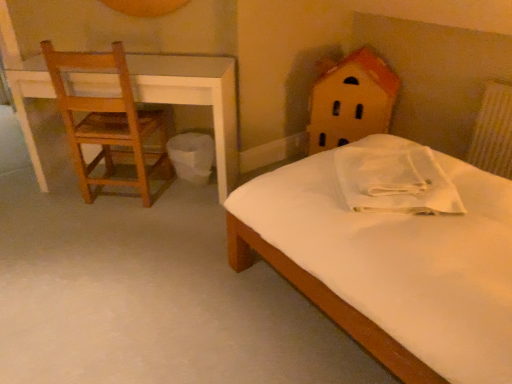
Find the location of a particular element. free point above white cotton pillow at center (from a real-world perspective) is located at coordinates (380, 172).